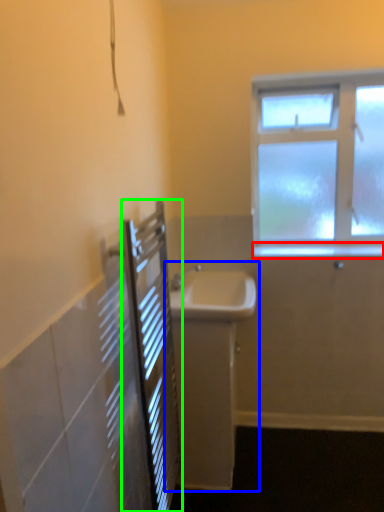
Question: Which is farther away from window sill (highlighted by a red box)? sink (highlighted by a blue box) or screen door (highlighted by a green box)?

Choices:
 (A) sink
 (B) screen door

Answer: (B)